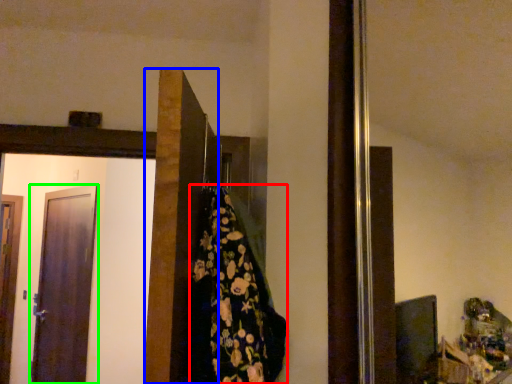
Question: Which is nearer to the blanket (highlighted by a red box)? door (highlighted by a blue box) or door (highlighted by a green box).

Choices:
 (A) door
 (B) door

Answer: (A)